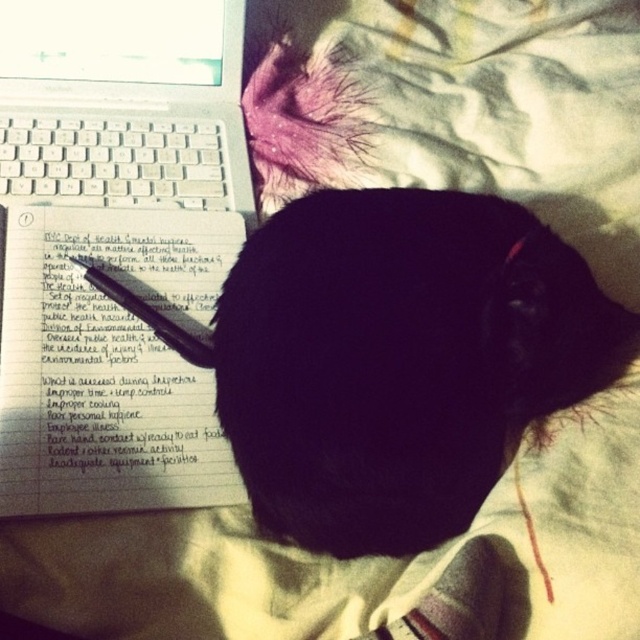
Question: Which point is farther to the camera?

Choices:
 (A) black fur cat at center
 (B) white plastic keyboard at upper left

Answer: (B)

Question: In this image, where is black fur cat at center located relative to black matte pen at upper left?

Choices:
 (A) above
 (B) below

Answer: (B)

Question: Which object appears closest to the camera in this image?

Choices:
 (A) white plastic keyboard at upper left
 (B) black fur cat at center
 (C) black matte pen at upper left

Answer: (B)

Question: Is black fur cat at center above black matte pen at upper left?

Choices:
 (A) no
 (B) yes

Answer: (A)

Question: Does black fur cat at center appear over black matte pen at upper left?

Choices:
 (A) no
 (B) yes

Answer: (A)

Question: Based on their relative distances, which object is farther from the black matte pen at upper left?

Choices:
 (A) white plastic keyboard at upper left
 (B) black fur cat at center

Answer: (B)